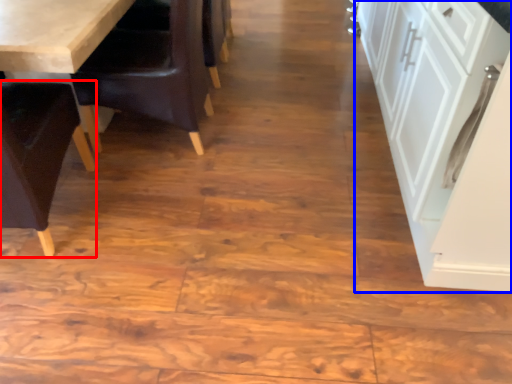
Question: Which object appears farthest to the camera in this image, chair (highlighted by a red box) or cabinetry (highlighted by a blue box)?

Choices:
 (A) chair
 (B) cabinetry

Answer: (A)